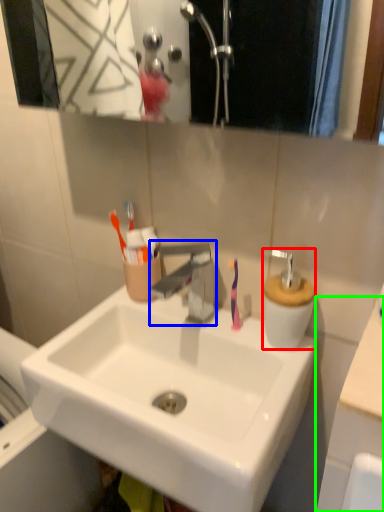
Question: Which object is positioned closest to soap dispenser (highlighted by a red box)? Select from tap (highlighted by a blue box) and counter top (highlighted by a green box).

Choices:
 (A) tap
 (B) counter top

Answer: (A)